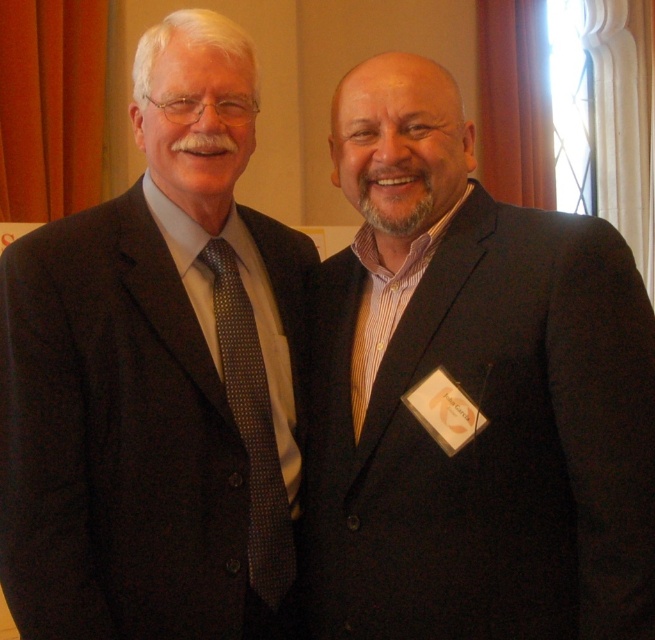
Can you confirm if matte black suit at center is bigger than matte black suit at left?

No.

Is matte black suit at center smaller than matte black suit at left?

Correct, matte black suit at center occupies less space than matte black suit at left.

Is point (563, 305) positioned before point (202, 630)?

Yes, point (563, 305) is in front of point (202, 630).

Locate an element on the screen. This screenshot has height=640, width=655. matte black suit at center is located at coordinates (470, 394).

What do you see at coordinates (157, 376) in the screenshot? The width and height of the screenshot is (655, 640). I see `matte black suit at left` at bounding box center [157, 376].

Is matte black suit at left wider than dark gray dotted tie at left?

Indeed, matte black suit at left has a greater width compared to dark gray dotted tie at left.

Where is `matte black suit at left`? The height and width of the screenshot is (640, 655). matte black suit at left is located at coordinates (157, 376).

Can you confirm if matte black suit at center is thinner than dark gray dotted tie at left?

No, matte black suit at center is not thinner than dark gray dotted tie at left.

Measure the distance between point [595,611] and camera.

They are 1.40 meters apart.

This screenshot has width=655, height=640. I want to click on matte black suit at center, so click(470, 394).